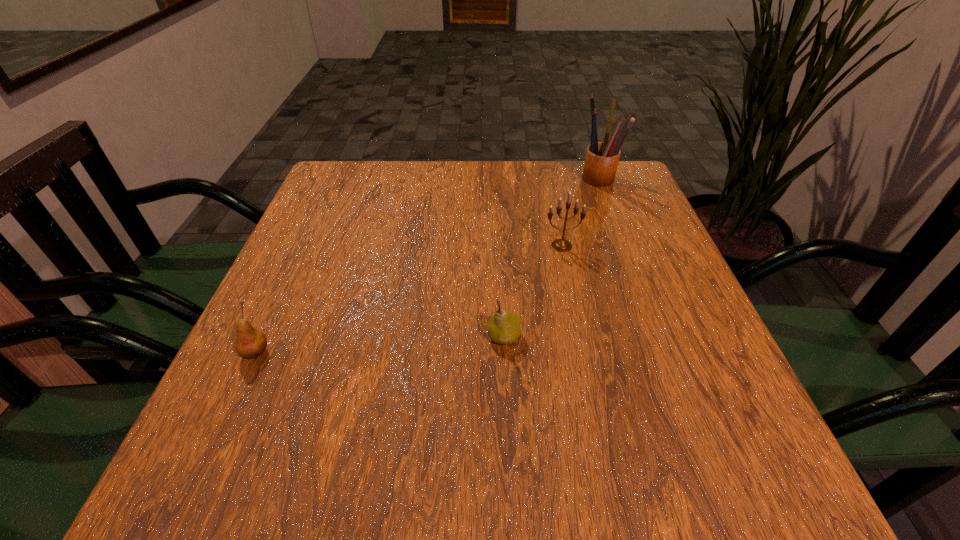
The image size is (960, 540). Find the location of `the tallest object`. the tallest object is located at coordinates (602, 158).

The height and width of the screenshot is (540, 960). I want to click on the farthest object, so click(602, 158).

You are a GUI agent. You are given a task and a screenshot of the screen. Output one action in this format:
    pyautogui.click(x=<x>, y=<y>)
    Task: Click on the candelabrum
    The width and height of the screenshot is (960, 540).
    Given the screenshot: What is the action you would take?
    pyautogui.click(x=561, y=245)

Locate an element on the screen. This screenshot has width=960, height=540. the second tallest object is located at coordinates (561, 245).

This screenshot has height=540, width=960. In order to click on the leftmost object in this screenshot , I will do `click(251, 343)`.

Identify the location of the second object from left to right. (504, 327).

The image size is (960, 540). I want to click on free space located 0.080m on the front of the tallest object, so click(x=611, y=212).

Identify the location of vacant point located 0.350m on the left of the second farthest object. The image size is (960, 540). (385, 246).

The height and width of the screenshot is (540, 960). In order to click on vacant space positioned on the back of the left pear in this screenshot , I will do `click(300, 257)`.

This screenshot has height=540, width=960. In order to click on vacant region located 0.140m on the right of the right pear in this screenshot , I will do `click(599, 336)`.